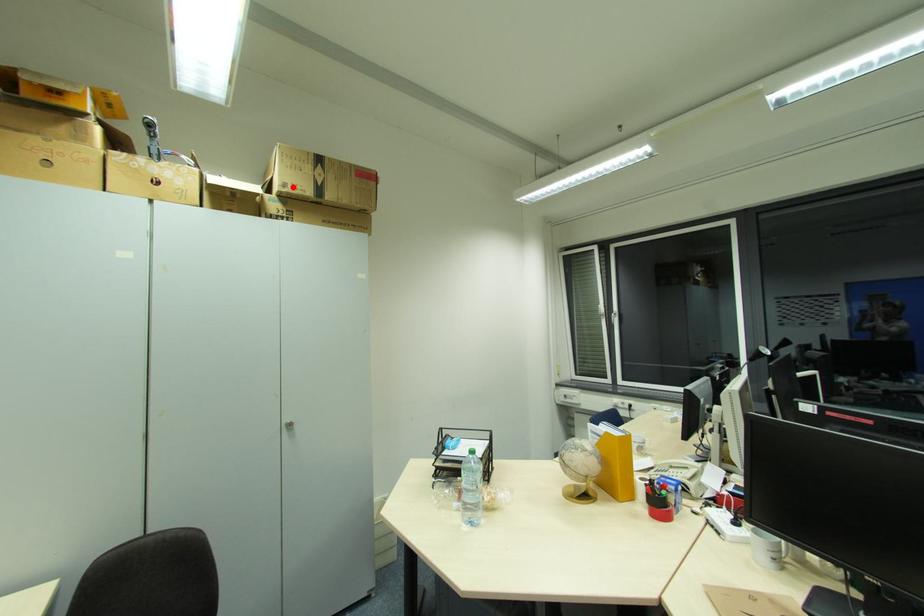
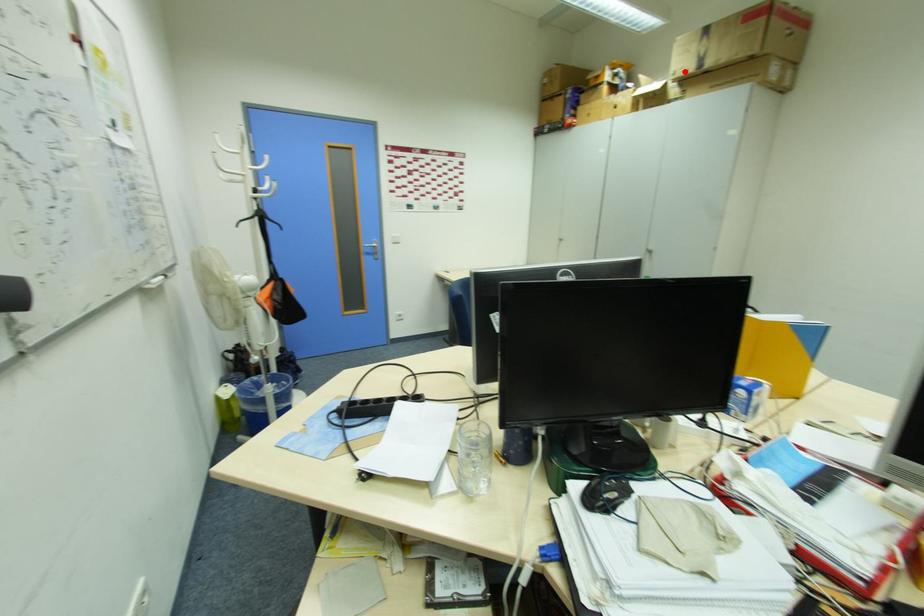
I am providing you with two images of the same scene from different viewpoints. A red point is marked on the first image and another point is marked on the second image. Is the marked point in image1 the same physical position as the marked point in image2?

Yes